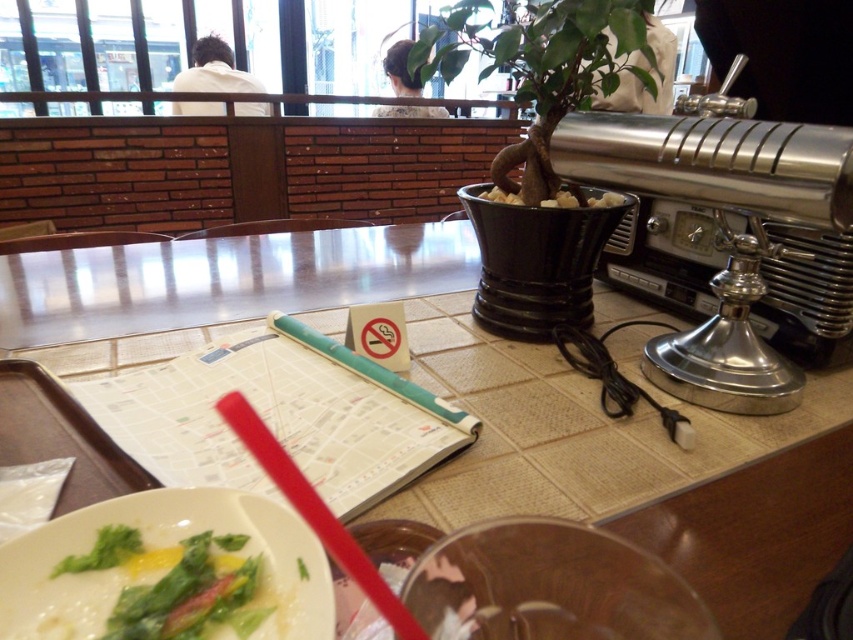
Question: Is white paper map at center bigger than red plastic straw at lower center?

Choices:
 (A) yes
 (B) no

Answer: (A)

Question: Which point is farther to the camera?

Choices:
 (A) white paper map at center
 (B) red plastic straw at lower center

Answer: (A)

Question: Which object is farther from the camera taking this photo?

Choices:
 (A) green leafy vegetable at center
 (B) white paper map at center

Answer: (B)

Question: Estimate the real-world distances between objects in this image. Which object is farther from the green leafy vegetable at center?

Choices:
 (A) white paper map at center
 (B) red plastic straw at lower center

Answer: (A)

Question: In this image, where is white paper map at center located relative to green leafy vegetable at center?

Choices:
 (A) below
 (B) above

Answer: (B)

Question: Does white paper map at center appear over green leafy vegetable at center?

Choices:
 (A) yes
 (B) no

Answer: (A)